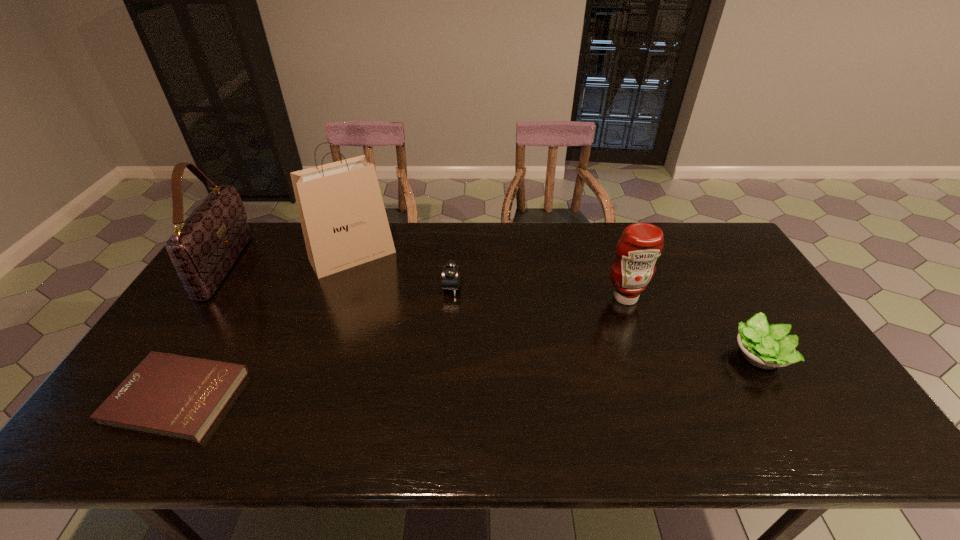
What are the coordinates of `shopping bag` in the screenshot? It's located at (344, 223).

Identify the location of handbag. This screenshot has width=960, height=540. (205, 246).

Identify the location of the third tallest object. (640, 245).

Where is `the second object from right to left`? the second object from right to left is located at coordinates (640, 245).

This screenshot has width=960, height=540. I want to click on alarm clock, so click(x=451, y=272).

Locate an element on the screen. This screenshot has height=540, width=960. lettuce is located at coordinates (766, 346).

This screenshot has width=960, height=540. Identify the location of hardback book. [180, 397].

The image size is (960, 540). Find the location of `free space located 0.170m on the left of the shopping bag`. free space located 0.170m on the left of the shopping bag is located at coordinates (260, 256).

The width and height of the screenshot is (960, 540). I want to click on vacant space located on the front of the handbag with the clasp, so click(318, 266).

Locate an element on the screen. The width and height of the screenshot is (960, 540). free space located 0.060m on the front of the condiment is located at coordinates (635, 323).